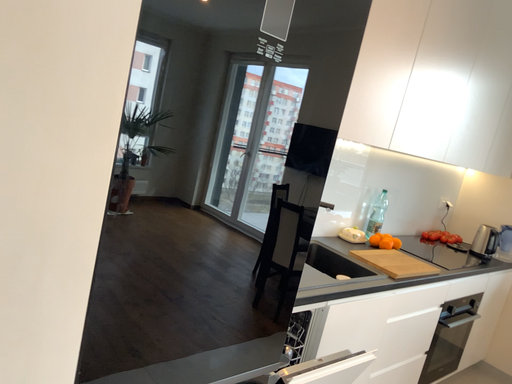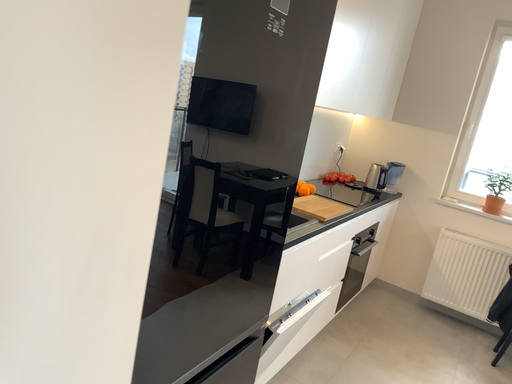
Question: Which way did the camera rotate in the video?

Choices:
 (A) rotated downward
 (B) rotated upward

Answer: (A)